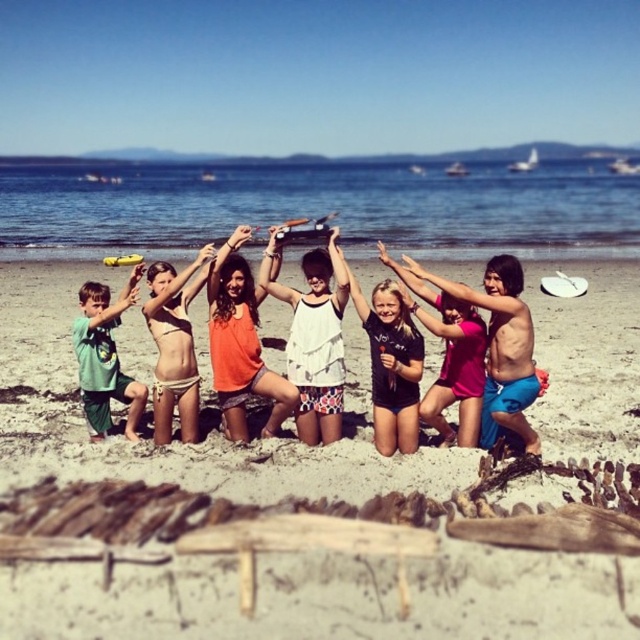
You are a photographer trying to capture a photo of the children on the beach. You notice the matte black surfboard at center and the green cotton shirt at left. Which object is positioned closer to you?

The matte black surfboard at center is closer to the viewer than the green cotton shirt at left.

You are a photographer trying to capture a photo of the children at the beach. You notice the white cotton dress at center and the beige bikini at center. Which clothing item is positioned higher in the image?

The white cotton dress at center is taller than the beige bikini at center, so it is positioned higher in the image.

You are a photographer trying to capture a closeup of two specific points in the beach scene. The first point is at coordinate point (310, 438) and the second is at point (176, 301). Which point should you focus on first if you want to take a photo that prioritizes the closer subject?

Point (310, 438) is closer to the camera than point (176, 301), so you should focus on point (310, 438) first to prioritize the closer subject.